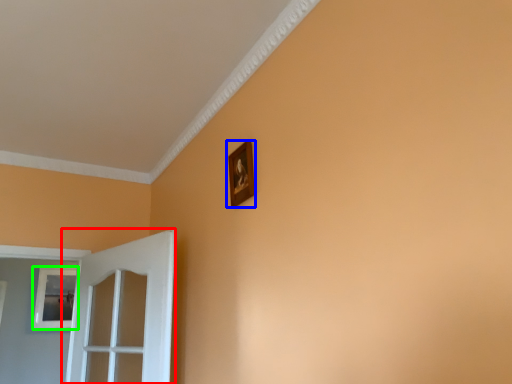
Question: Considering the real-world distances, which object is closest to door (highlighted by a red box)? picture frame (highlighted by a blue box) or picture frame (highlighted by a green box).

Choices:
 (A) picture frame
 (B) picture frame

Answer: (A)